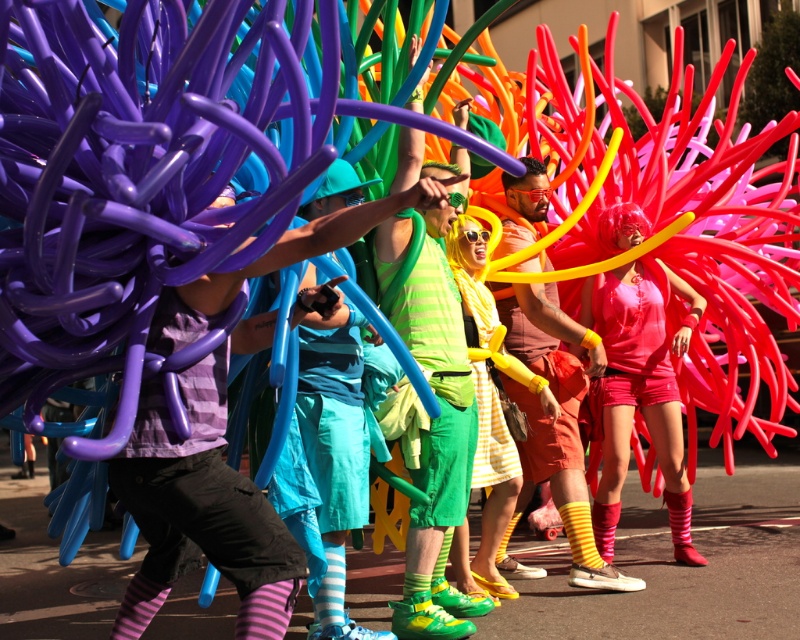
Measure the distance between matte purple balloon at center and camera.

The distance of matte purple balloon at center from camera is 14.04 feet.

Is matte purple balloon at center smaller than matte pink tank top at center?

Correct, matte purple balloon at center occupies less space than matte pink tank top at center.

The width and height of the screenshot is (800, 640). I want to click on matte purple balloon at center, so click(200, 513).

Find the location of a particular element. The width and height of the screenshot is (800, 640). matte purple balloon at center is located at coordinates (200, 513).